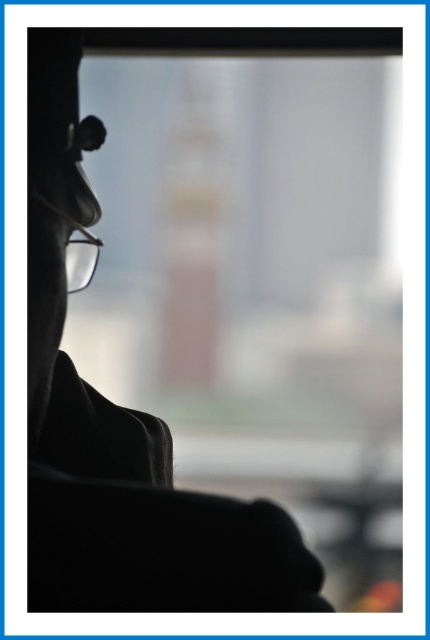
Does silhouette coat at left appear on the right side of transparent plastic glasses at left?

Yes, silhouette coat at left is to the right of transparent plastic glasses at left.

Between silhouette coat at left and transparent plastic glasses at left, which one is positioned higher?

transparent plastic glasses at left is higher up.

Does point (218, 576) lie in front of point (49, 163)?

Yes, it is.

Where is `silhouette coat at left`? silhouette coat at left is located at coordinates click(120, 435).